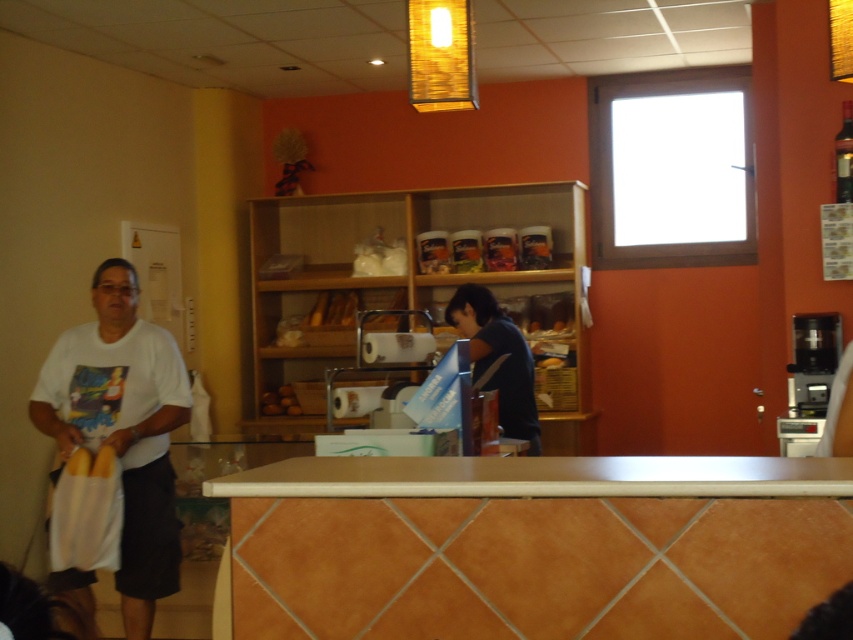
You are a customer in the bakery and want to place your bag on the smooth beige counter at center. However, there is a white cotton shirt at left on it. Can you put your bag there without moving the shirt?

The smooth beige counter at center occupies less space than the white cotton shirt at left, so there might not be enough room to place your bag without disturbing the shirt.

You are a customer standing at the entrance of the bakery. You see the light brown wood counter top at center. Can you estimate the coordinates of the counter top relative to your position?

The light brown wood counter top at center is located at point (540,477) relative to your position.